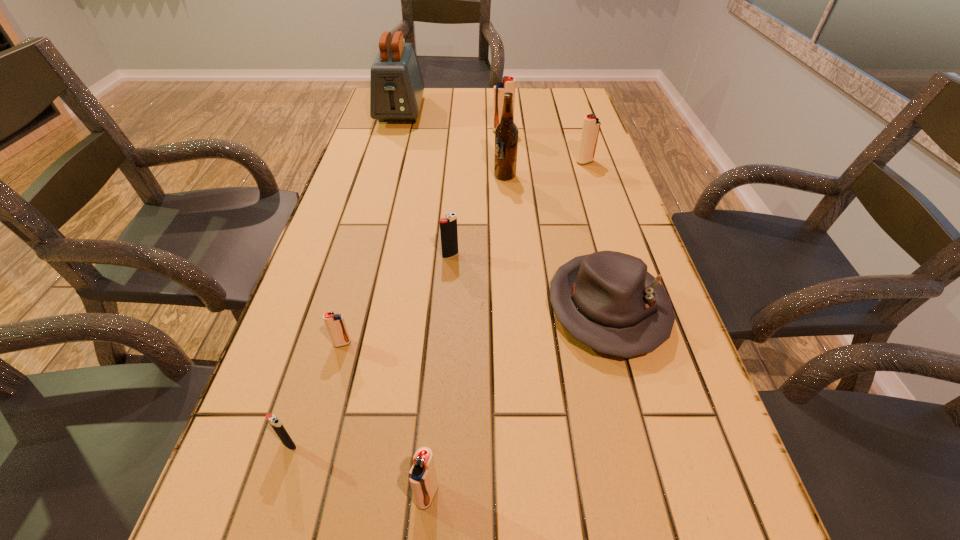
The height and width of the screenshot is (540, 960). Identify the location of vacant position in the image that satisfies the following two spatial constraints: 1. on the front side of the nearest igniter; 2. on the right side of the second nearest red igniter. (301, 495).

The image size is (960, 540). Identify the location of free space in the image that satisfies the following two spatial constraints: 1. on the front side of the biggest red igniter; 2. on the left side of the fifth nearest igniter. (505, 162).